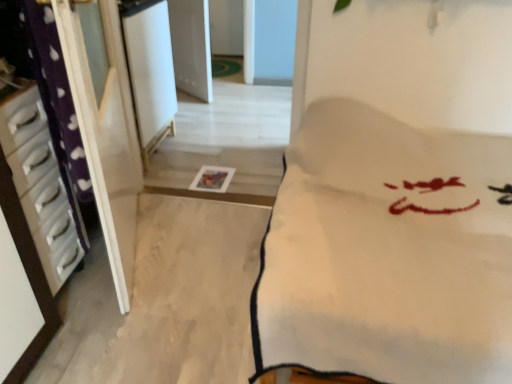
The width and height of the screenshot is (512, 384). In order to click on free spot in front of white glossy screen door at upper center in this screenshot , I will do `click(170, 175)`.